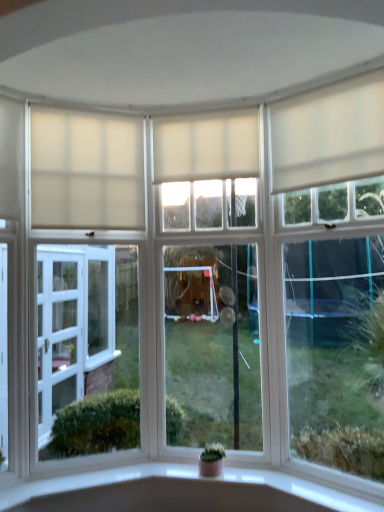
Question: Does green matte houseplant at center come in front of white matte curtain at upper center, the 3th curtain in the right-to-left sequence?

Choices:
 (A) yes
 (B) no

Answer: (A)

Question: Is green matte houseplant at center smaller than white matte curtain at upper center, which is the first curtain from left to right?

Choices:
 (A) no
 (B) yes

Answer: (B)

Question: From a real-world perspective, is green matte houseplant at center positioned under white matte curtain at upper center, which is the first curtain from left to right, based on gravity?

Choices:
 (A) no
 (B) yes

Answer: (B)

Question: Is the surface of green matte houseplant at center in direct contact with white matte curtain at upper center, the 3th curtain in the right-to-left sequence?

Choices:
 (A) yes
 (B) no

Answer: (B)

Question: Can you confirm if green matte houseplant at center is positioned to the left of white matte curtain at upper center, the 3th curtain in the right-to-left sequence?

Choices:
 (A) no
 (B) yes

Answer: (A)

Question: From a real-world perspective, is white matte curtain at upper right, the 1th curtain positioned from the right, physically located above or below white matte window at right, the 2th window when ordered from left to right?

Choices:
 (A) below
 (B) above

Answer: (B)

Question: Would you say white matte curtain at upper right, the 3th curtain when ordered from left to right, is inside or outside white matte window at right, the 2th window when ordered from left to right?

Choices:
 (A) outside
 (B) inside

Answer: (A)

Question: Based on their sizes in the image, would you say white matte curtain at upper right, the 3th curtain when ordered from left to right, is bigger or smaller than white matte window at right, which is the 1th window in right-to-left order?

Choices:
 (A) big
 (B) small

Answer: (B)

Question: From the image's perspective, is white matte curtain at upper right, the 3th curtain when ordered from left to right, positioned above or below white matte window at right, the 2th window when ordered from left to right?

Choices:
 (A) above
 (B) below

Answer: (A)

Question: In terms of width, does white matte curtain at center, which ranks as the 2th curtain in left-to-right order, look wider or thinner when compared to white matte window at right, which is the 1th window in right-to-left order?

Choices:
 (A) wide
 (B) thin

Answer: (A)

Question: From the image's perspective, relative to white matte window at right, the 2th window when ordered from left to right, is white matte curtain at center, placed as the 2th curtain when sorted from right to left, above or below?

Choices:
 (A) below
 (B) above

Answer: (B)

Question: Considering their positions, is white matte curtain at center, which ranks as the 2th curtain in left-to-right order, located in front of or behind white matte window at right, the 2th window when ordered from left to right?

Choices:
 (A) behind
 (B) front

Answer: (A)

Question: Based on their sizes in the image, would you say white matte curtain at center, placed as the 2th curtain when sorted from right to left, is bigger or smaller than white matte window at right, the 2th window when ordered from left to right?

Choices:
 (A) big
 (B) small

Answer: (B)

Question: Relative to green matte houseplant at center, is clear glass window at center, arranged as the first window when viewed from the left, in front or behind?

Choices:
 (A) behind
 (B) front

Answer: (A)

Question: Is clear glass window at center, placed as the 2th window when sorted from right to left, taller or shorter than green matte houseplant at center?

Choices:
 (A) short
 (B) tall

Answer: (B)